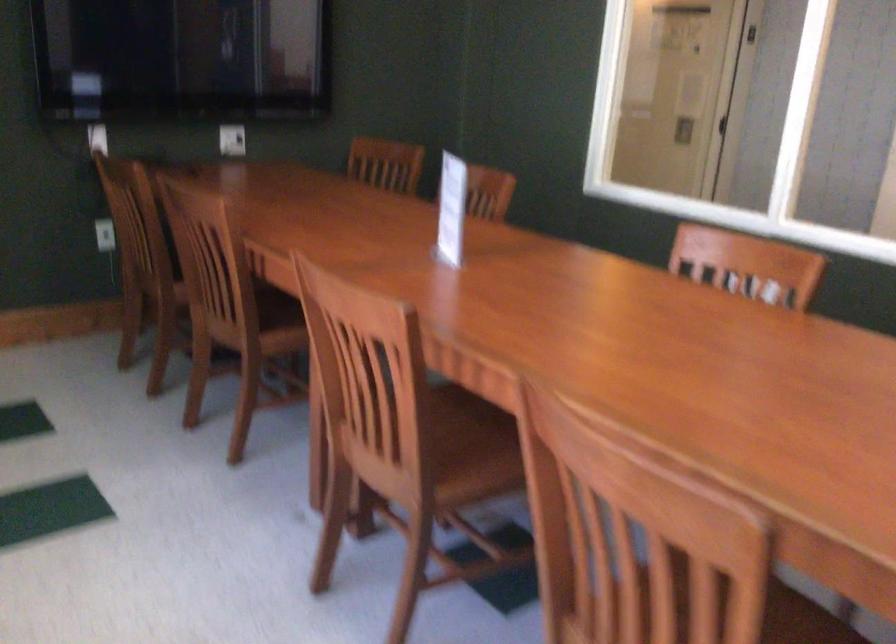
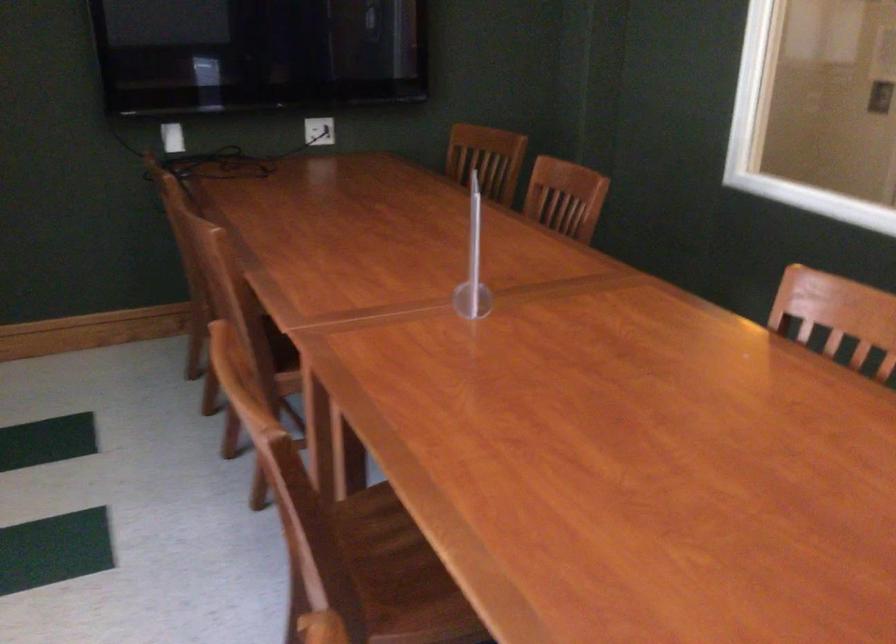
Where in the second image is the point corresponding to pixel 382 431 from the first image?

(341, 529)